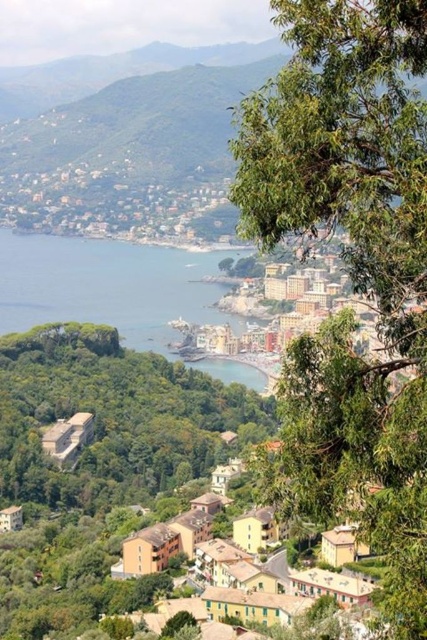
You are standing at the point labeled as point (351, 262) in the image. Looking towards the town, which direction should you walk to reach the green leafy tree at upper right?

The point (351, 262) is already at the green leafy tree at upper right, so you are already there.